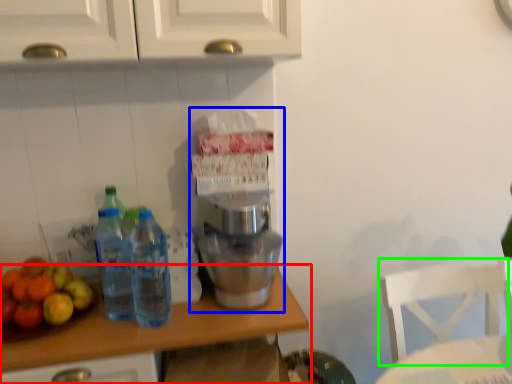
Question: Which is nearer to the countertop (highlighted by a red box)? home appliance (highlighted by a blue box) or chair (highlighted by a green box).

Choices:
 (A) home appliance
 (B) chair

Answer: (A)